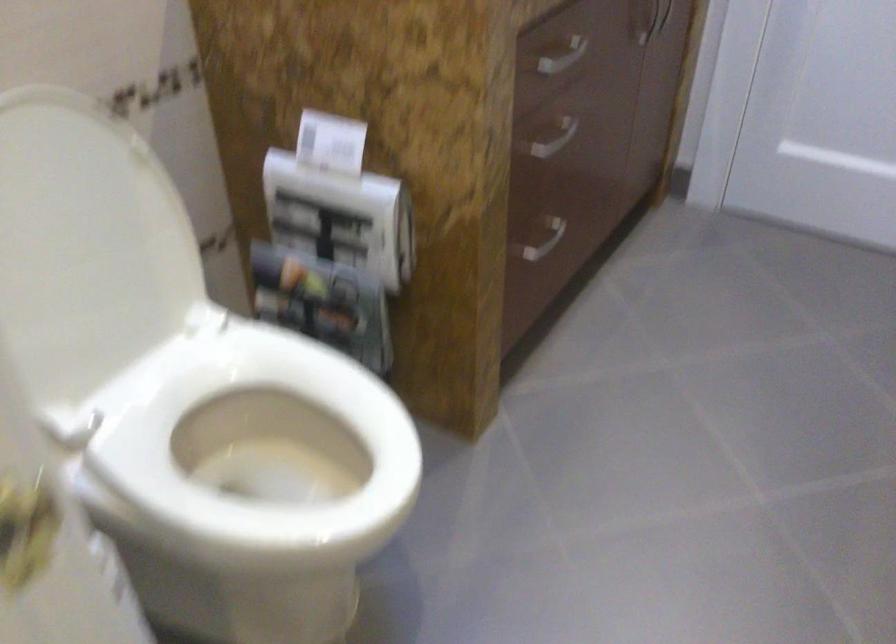
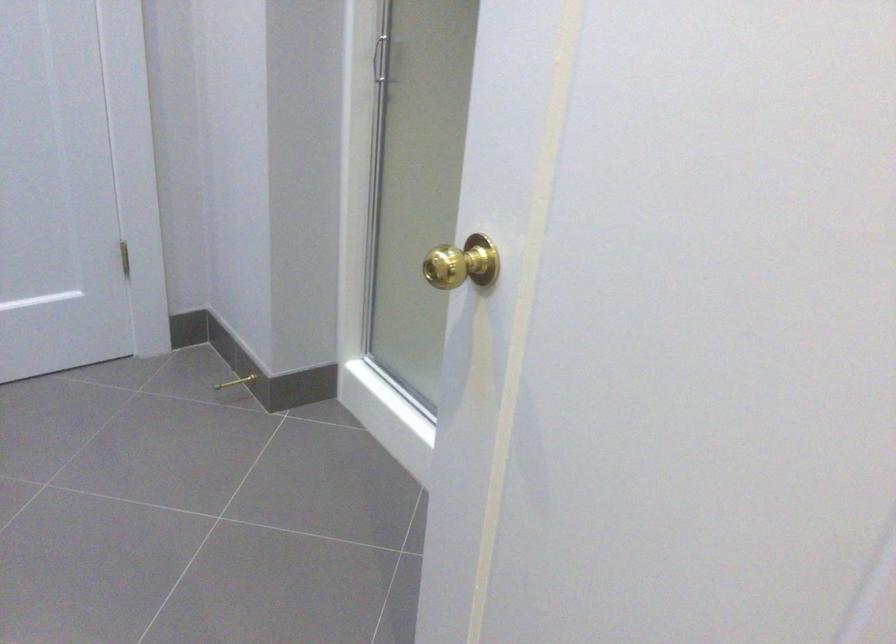
Question: Based on the continuous images, in which direction is the camera rotating? Reply with the corresponding letter.

Choices:
 (A) Left
 (B) Right
 (C) Up
 (D) Down

Answer: (B)